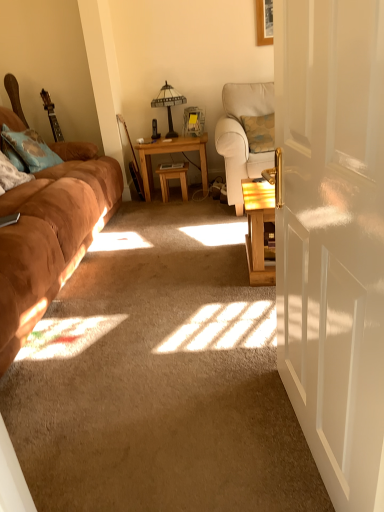
Question: Is white glossy door at center right wider or thinner than suede brown couch at left?

Choices:
 (A) wide
 (B) thin

Answer: (B)

Question: From a real-world perspective, is white glossy door at center right physically located above or below suede brown couch at left?

Choices:
 (A) above
 (B) below

Answer: (A)

Question: Which object is positioned closest to the light beige fabric chair at center right?

Choices:
 (A) wooden table at center, which is counted as the 2th table, starting from the left
 (B) light brown wooden table at center, which is the first table from left to right
 (C) blue textured pillow at left
 (D) suede brown couch at left
 (E) matte glass table lamp at center

Answer: (B)

Question: Considering the real-world distances, which object is farthest from the suede brown couch at left?

Choices:
 (A) white glossy door at center right
 (B) matte glass table lamp at center
 (C) light brown wooden table at center, which is the first table from left to right
 (D) blue textured pillow at left
 (E) matte plastic picture frame at center

Answer: (E)